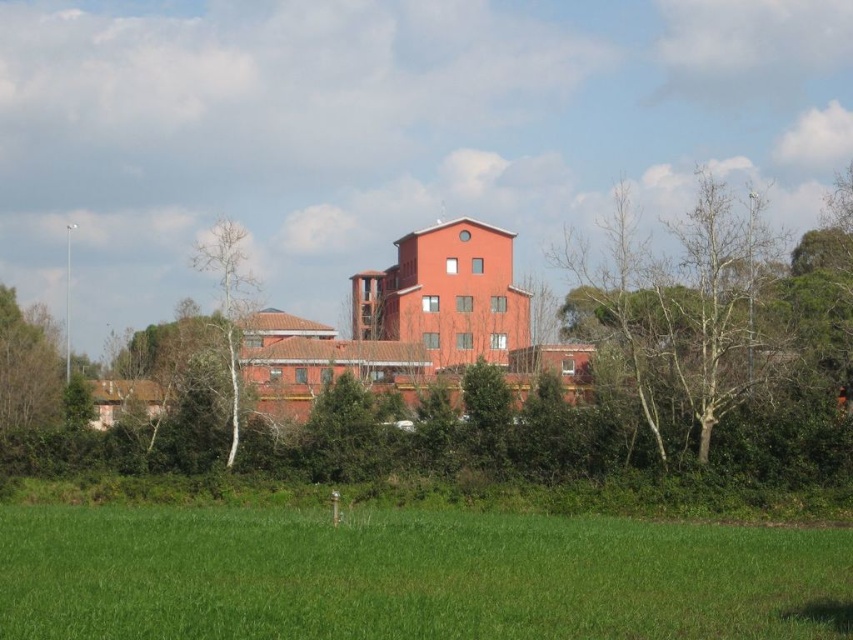
You are a landscape architect planning to install a new pathway. You need to know which object is shorter between the green grass at lower center and the bare wood tree at left. Which one is shorter?

The green grass at lower center is not as tall as the bare wood tree at left, so the green grass at lower center is shorter.